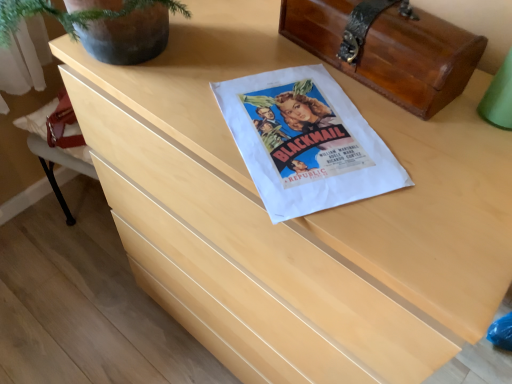
I want to click on vacant area that is in front of shiny brown wood chest at upper right, so click(374, 145).